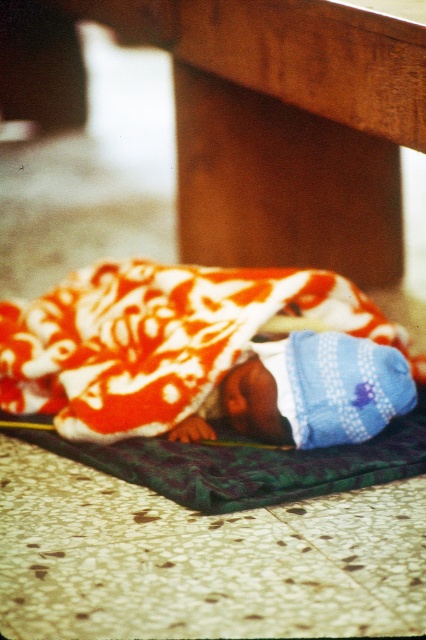
You are a photographer setting up for a shoot and need to place a 15 cm wide camera on the floor. You have two options near the child lying on the mat. Which object between the brown wood table at lower center and the blue knitted hat at lower center would allow the camera to fit next to it without overlapping?

The brown wood table at lower center has a larger width than the blue knitted hat at lower center, so placing the camera next to the brown wood table at lower center would provide enough space for the camera to fit without overlapping.

You are a photographer trying to capture the blue knitted hat at lower center and the brown wood table at lower center in the same frame. Since both are at lower center, how can you adjust your camera angle to ensure both are visible?

The brown wood table at lower center is positioned on the left side of the blue knitted hat at lower center, so you can adjust your camera angle to the right to include both objects in the frame.

You are a photographer adjusting your camera to focus on two points in the image. The first point is labeled as point (150, 29) and the second is point (342, 374). Which point is closer to your camera lens?

Point (150, 29) is closer to the camera lens because it is further to the viewer than point (342, 374).